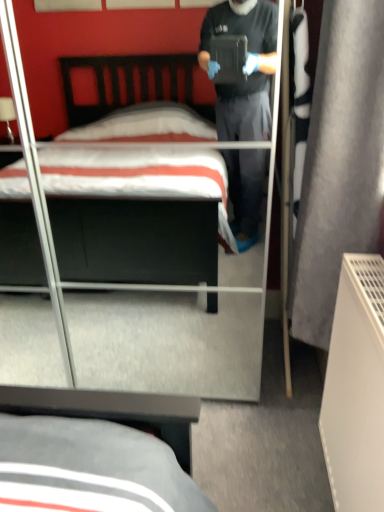
In order to click on free region under matte black bed at center (from a real-world perspective) in this screenshot , I will do `click(106, 349)`.